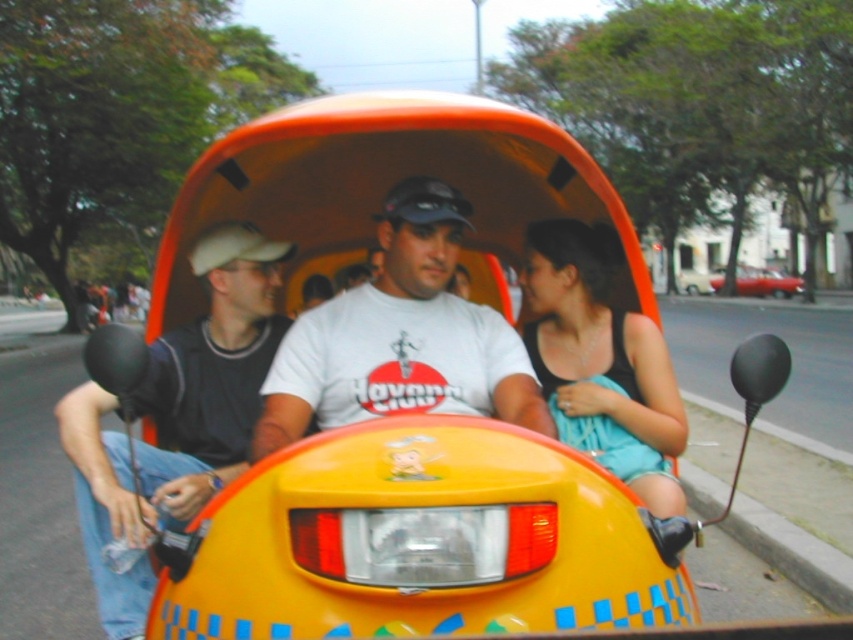
Does point (74, 406) come in front of point (664, 483)?

No, it is not.

Which is above, matte black shirt at left or black matte tank top at center?

Positioned higher is matte black shirt at left.

Who is more distant from viewer, (213, 417) or (590, 387)?

The point (213, 417) is more distant.

What are the coordinates of `matte black shirt at left` in the screenshot? It's located at (177, 417).

Does white matte t-shirt at center come behind shiny red car at center?

No, white matte t-shirt at center is in front of shiny red car at center.

Is white matte t-shirt at center bigger than shiny red car at center?

No, white matte t-shirt at center is not bigger than shiny red car at center.

The image size is (853, 640). Identify the location of white matte t-shirt at center. (401, 337).

Does matte black shirt at left appear on the right side of shiny red car at center?

Incorrect, matte black shirt at left is not on the right side of shiny red car at center.

Which is in front, point (207, 483) or point (743, 276)?

Point (207, 483) is in front.

Where is `matte black shirt at left`? matte black shirt at left is located at coordinates (177, 417).